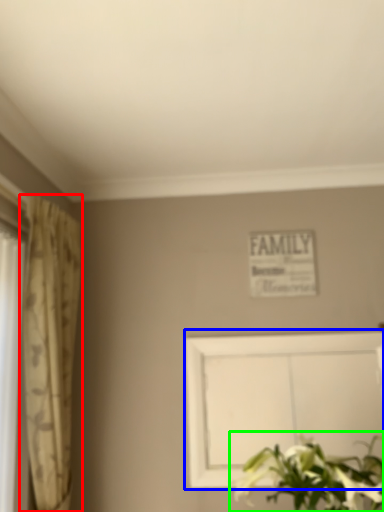
Question: Based on their relative distances, which object is nearer to curtain (highlighted by a red box)? Choose from picture frame (highlighted by a blue box) and floral arrangement (highlighted by a green box).

Choices:
 (A) picture frame
 (B) floral arrangement

Answer: (A)